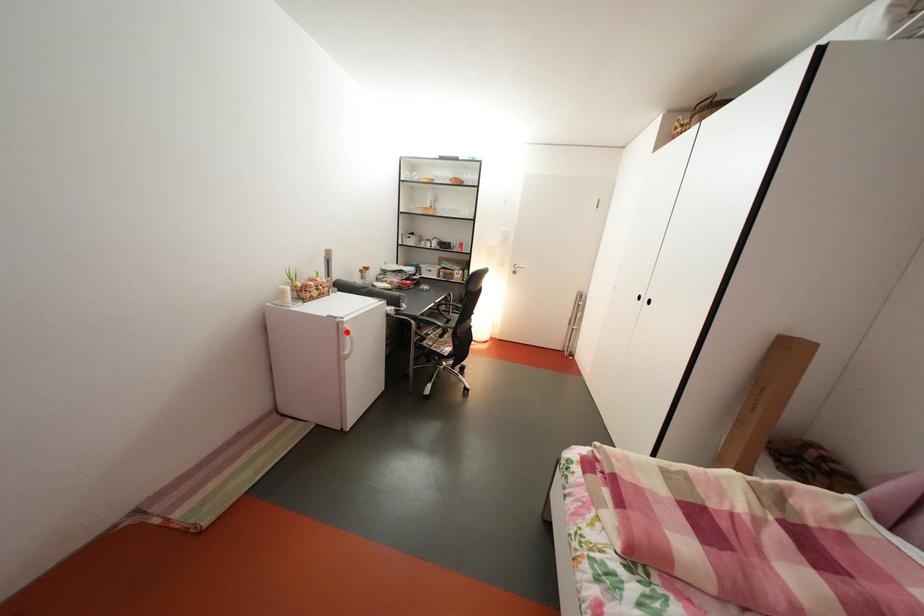
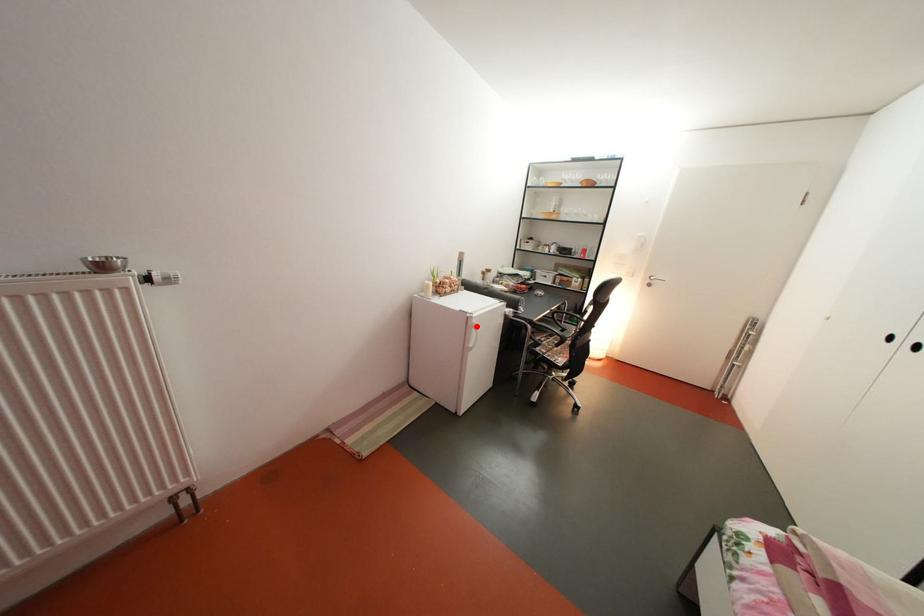
I am providing you with two images of the same scene from different viewpoints. A red point is marked on the first image and another point is marked on the second image. Is the marked point in image1 the same physical position as the marked point in image2?

Yes